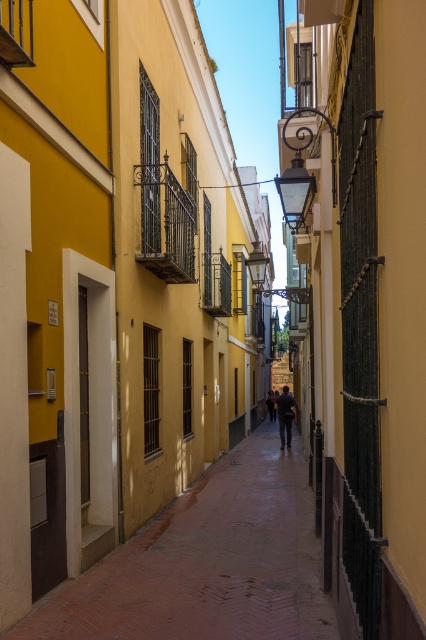
You are a tourist standing in the alleyway and want to take a photo of the brick paved path at center without anyone in the frame. Since the dark blue jeans at center belong to a person standing there, can you step aside to capture the path without including the person?

The brick paved path at center is in front of dark blue jeans at center, meaning the person is standing between you and the path. To take a photo of the path without the person, you would need to move around the person to get a clear view.

You are standing at the entrance of the alleyway and want to walk towards the brick paved path at center. According to the image, which direction should you move to reach it?

The brick paved path at center is located at point (207, 563), so you should move forward and slightly to the right to reach it.

You are a delivery person carrying a large box and need to walk down the brick paved path at center while avoiding stepping on the dark blue jeans at center. Can you pass through the path without touching the jeans?

The brick paved path at center is wider than the dark blue jeans at center, so yes, you can pass through the path without touching the jeans.